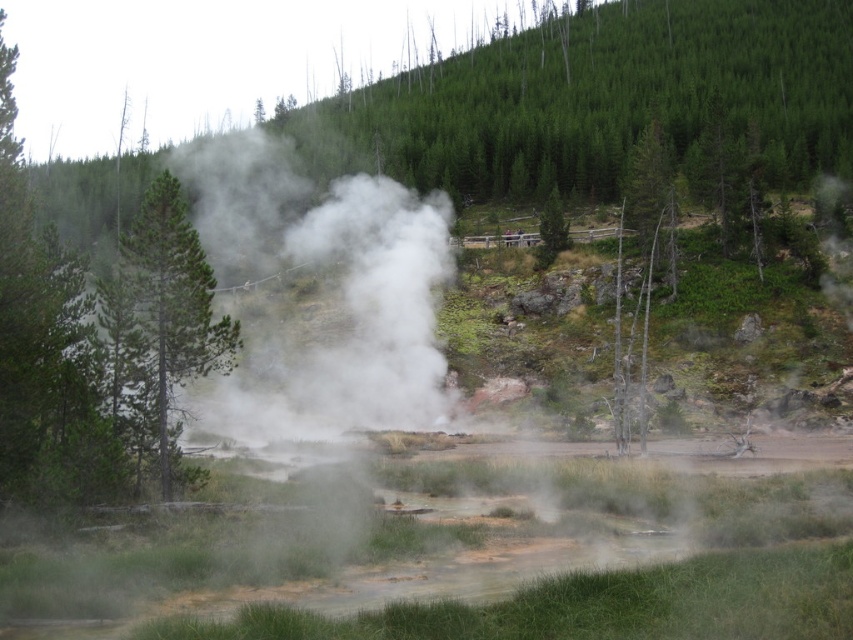
Which is in front, point (199, 355) or point (544, 212)?

Point (199, 355)

Between point (169, 300) and point (550, 250), which one is positioned behind?

The point (550, 250) is behind.

In order to click on green matte tree at center-left in this screenshot , I will do `click(175, 300)`.